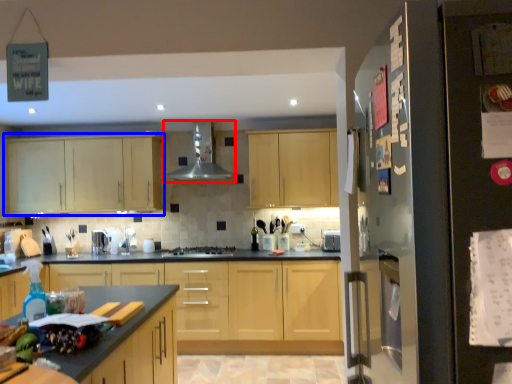
Question: Which of the following is the farthest to the observer, exhaust hood (highlighted by a red box) or cabinetry (highlighted by a blue box)?

Choices:
 (A) exhaust hood
 (B) cabinetry

Answer: (B)